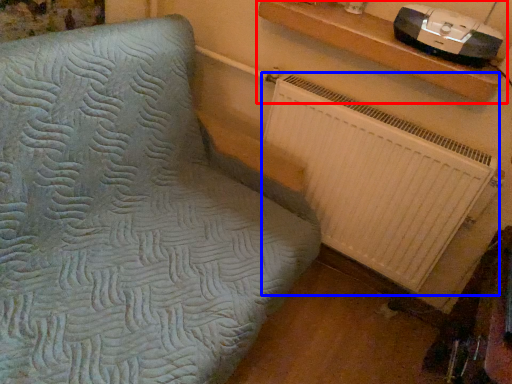
Question: Among these objects, which one is farthest to the camera, shelf (highlighted by a red box) or radiator (highlighted by a blue box)?

Choices:
 (A) shelf
 (B) radiator

Answer: (B)